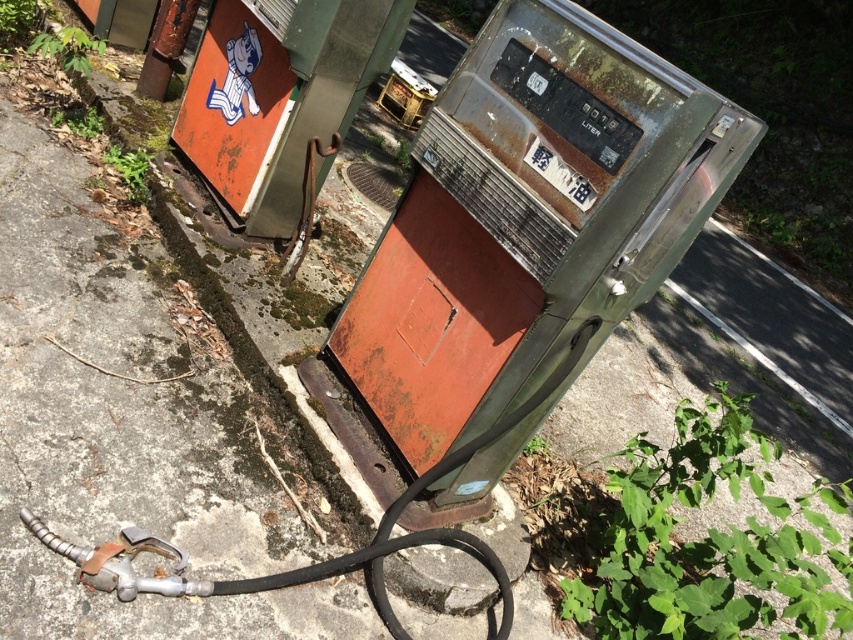
You are a maintenance worker inspecting the old gas pump. You need to place a safety cone exactly at the location of the green leafy plant at lower right. What are the coordinates where you should place the safety cone?

The coordinates for the green leafy plant at lower right are at point (709, 541), so you should place the safety cone there.

You are a gardener who wants to water both the green leafy plant at lower right and the green leafy plant at upper left. You have a watering can that can hold enough water for 3 meters of travel. Do you think you can water both plants without needing to refill your watering can?

The green leafy plant at lower right is 3.73 meters away from the green leafy plant at upper left. Since the distance between them is greater than 3 meters, you will need to refill your watering can before watering both plants.

You are a gardener trying to decide which plant to water first. The green leafy plant at lower right and the green leafy weed at upper left are both in need of care. Based on their sizes, which one should you prioritize watering?

The green leafy plant at lower right might be wider than the green leafy weed at upper left, so it may require more water due to its larger size.